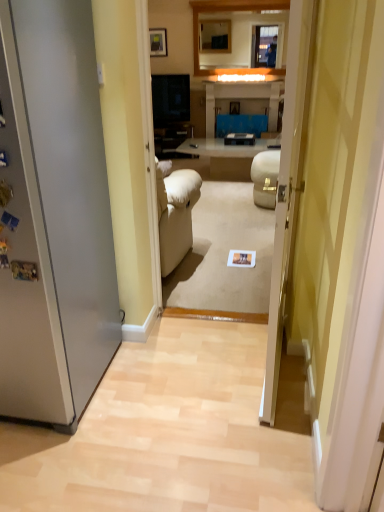
Question: Is transparent glass door at center bigger than matte black picture frame at upper center?

Choices:
 (A) yes
 (B) no

Answer: (A)

Question: From a real-world perspective, is transparent glass door at center physically below matte black picture frame at upper center?

Choices:
 (A) yes
 (B) no

Answer: (A)

Question: Does transparent glass door at center have a smaller size compared to matte black picture frame at upper center?

Choices:
 (A) no
 (B) yes

Answer: (A)

Question: From the image's perspective, is transparent glass door at center below matte black picture frame at upper center?

Choices:
 (A) no
 (B) yes

Answer: (B)

Question: From the image's perspective, would you say transparent glass door at center is positioned over matte black picture frame at upper center?

Choices:
 (A) no
 (B) yes

Answer: (A)

Question: Can you confirm if transparent glass door at center is shorter than matte black picture frame at upper center?

Choices:
 (A) no
 (B) yes

Answer: (A)

Question: Could you tell me if matte black picture frame at upper center is facing transparent glass door at center?

Choices:
 (A) yes
 (B) no

Answer: (A)

Question: From a real-world perspective, is matte black picture frame at upper center located beneath transparent glass door at center?

Choices:
 (A) no
 (B) yes

Answer: (A)

Question: From the image's perspective, is matte black picture frame at upper center above transparent glass door at center?

Choices:
 (A) no
 (B) yes

Answer: (B)

Question: Is transparent glass door at center surrounded by matte black picture frame at upper center?

Choices:
 (A) no
 (B) yes

Answer: (A)

Question: Is matte black picture frame at upper center positioned with its back to transparent glass door at center?

Choices:
 (A) yes
 (B) no

Answer: (B)

Question: Is the position of matte black picture frame at upper center more distant than that of transparent glass door at center?

Choices:
 (A) yes
 (B) no

Answer: (A)

Question: In terms of width, does matte black picture frame at upper center look wider or thinner when compared to transparent glass door at center?

Choices:
 (A) wide
 (B) thin

Answer: (B)